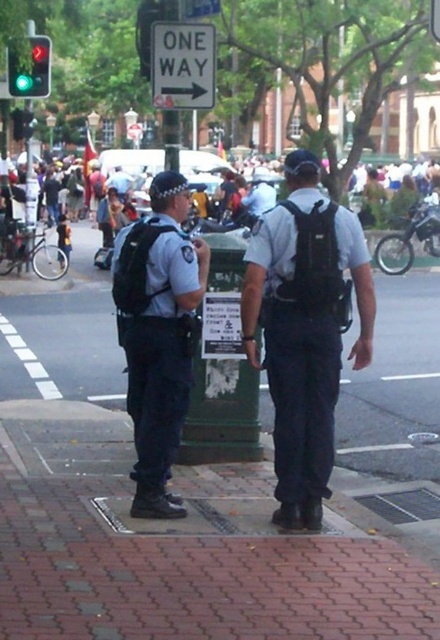
Based on the scene, which object is bigger between the matte black uniform at center and the white plastic one way sign at upper center?

The matte black uniform at center is larger in size than the white plastic one way sign at upper center.

You are a delivery person needing to check the distance between the matte black uniform at center and the white plastic one way sign at upper center. Can you confirm if the distance is more than 2 meters?

The matte black uniform at center is 2.86 meters from the white plastic one way sign at upper center, so yes, the distance is more than 2 meters.

You are a pedestrian trying to cross the street and see the matte black uniform at center and the white plastic sign at upper center. Which object is nearer to you?

The matte black uniform at center is closer to the viewer than the white plastic sign at upper center.